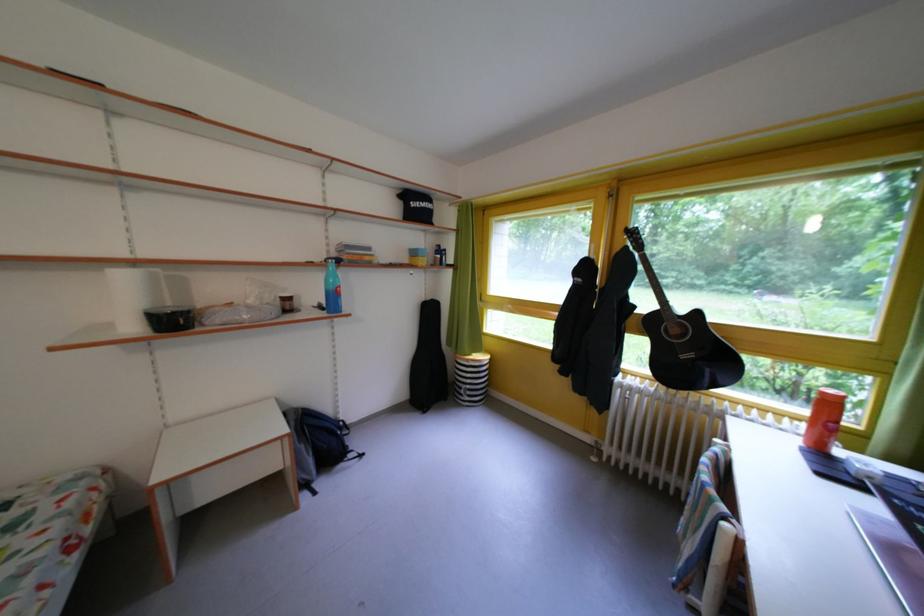
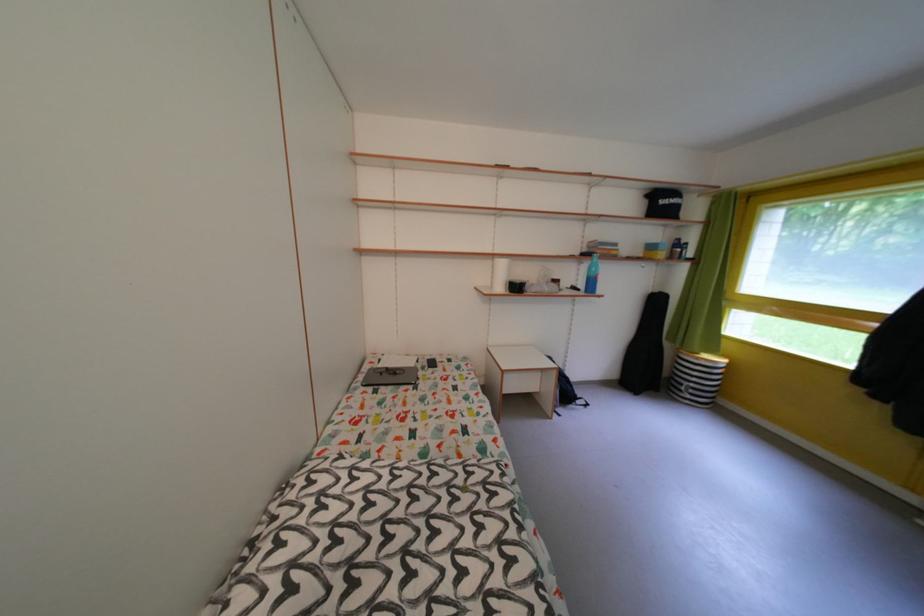
Find the pixel in the second image that matches the point at 344,261 in the first image.

(594, 256)